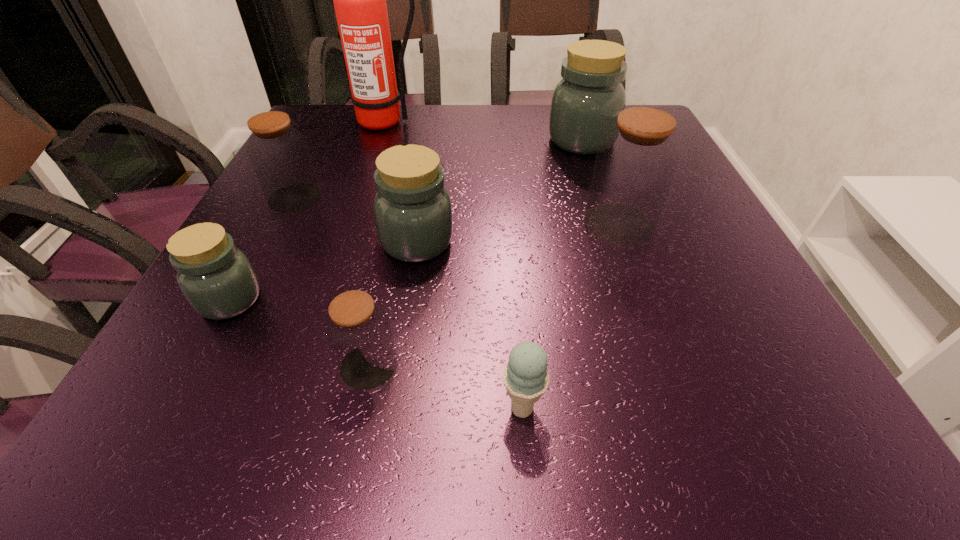
Where is `fire extinguisher`? This screenshot has width=960, height=540. fire extinguisher is located at coordinates (359, 0).

Locate an element on the screen. the tallest object is located at coordinates (359, 0).

At what (x,y) coordinates should I click in order to perform the action: click on the biggest brown jar. Please return your answer as a coordinate pair (x, y). This screenshot has height=540, width=960. Looking at the image, I should click on (634, 167).

Find the location of `the rightmost green jar`. the rightmost green jar is located at coordinates 590,95.

This screenshot has height=540, width=960. I want to click on the farthest green jar, so click(x=590, y=95).

Find the location of a particular element. This screenshot has height=540, width=960. the second smallest brown jar is located at coordinates (279, 154).

This screenshot has width=960, height=540. Identify the location of the second nearest green jar. (412, 209).

Identify the location of the second biggest green jar. (412, 209).

Find the location of `the third nearest object`. the third nearest object is located at coordinates (217, 279).

Where is `the fifth farthest jar`? This screenshot has width=960, height=540. the fifth farthest jar is located at coordinates (217, 279).